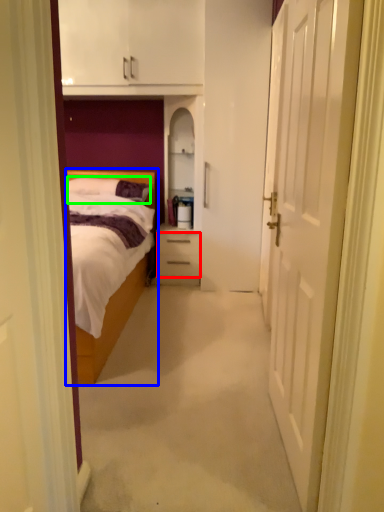
Question: Considering the real-world distances, which object is closest to drawer (highlighted by a red box)? bed (highlighted by a blue box) or pillow (highlighted by a green box).

Choices:
 (A) bed
 (B) pillow

Answer: (B)